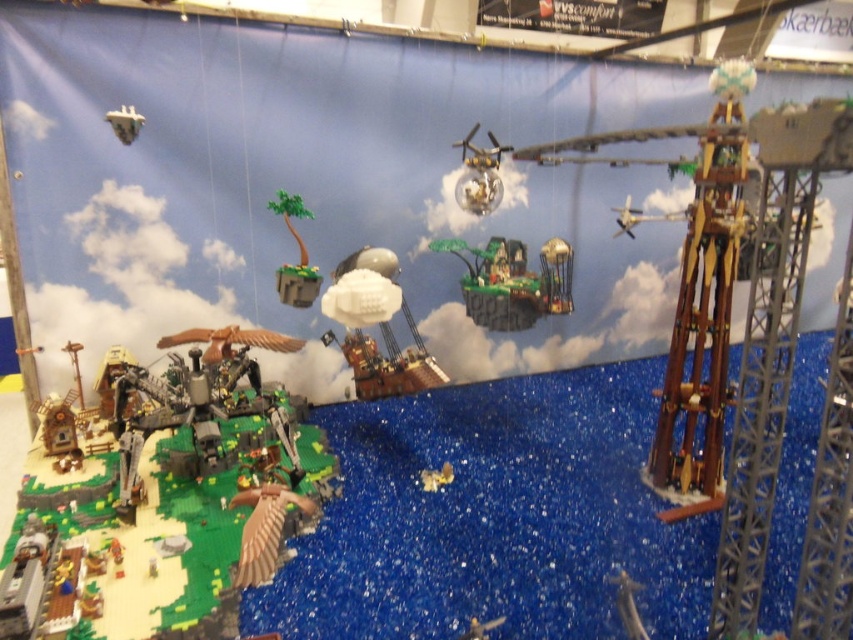
Question: Which point is closer to the camera taking this photo?

Choices:
 (A) (286, 291)
 (B) (584, 102)

Answer: (A)

Question: Which object appears farthest from the camera in this image?

Choices:
 (A) transparent plastic sphere at upper center
 (B) white matte airship at center

Answer: (A)

Question: Which point appears closest to the camera in this image?

Choices:
 (A) (136, 406)
 (B) (461, 177)
 (C) (123, 125)

Answer: (C)

Question: Does white matte airship at center appear on the right side of metallic silver spaceship at upper left?

Choices:
 (A) yes
 (B) no

Answer: (A)

Question: Observing the image, what is the correct spatial positioning of green plastic island at center in reference to white matte airship at center?

Choices:
 (A) left
 (B) right

Answer: (B)

Question: Does white matte airship at center have a greater width compared to metallic silver spaceship at upper left?

Choices:
 (A) yes
 (B) no

Answer: (A)